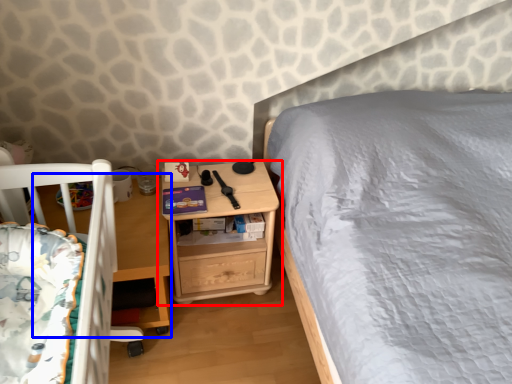
Question: Among these objects, which one is nearest to the camera, nightstand (highlighted by a red box) or table (highlighted by a blue box)?

Choices:
 (A) nightstand
 (B) table

Answer: (B)